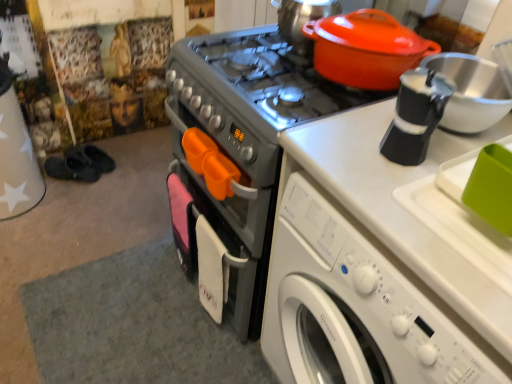
Question: From a real-world perspective, is matte orange pot at upper right positioned above or below metallic gray stove at center?

Choices:
 (A) below
 (B) above

Answer: (B)

Question: Considering the positions of point (350, 43) and point (241, 299), is point (350, 43) closer or farther from the camera than point (241, 299)?

Choices:
 (A) closer
 (B) farther

Answer: (A)

Question: Considering the real-world distances, which object is closest to the matte orange pot at upper right?

Choices:
 (A) matte orange tea pot at upper right
 (B) white plastic washing machine at lower right
 (C) metallic gray stove at center

Answer: (A)

Question: Which object is positioned farthest from the white plastic washing machine at lower right?

Choices:
 (A) metallic gray stove at center
 (B) matte orange pot at upper right
 (C) matte orange tea pot at upper right

Answer: (C)